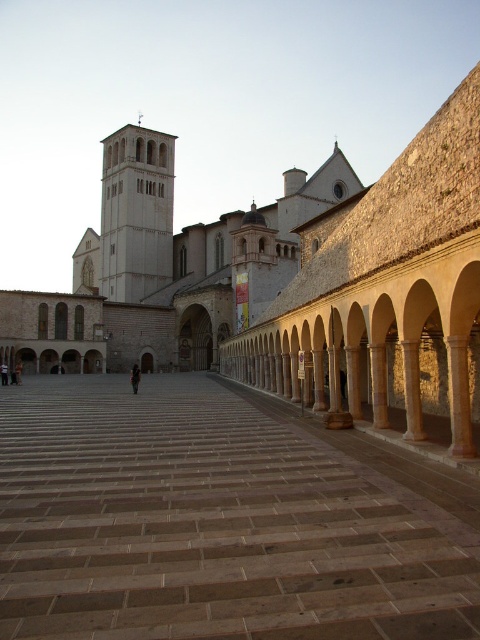
Who is more distant from viewer, (54, 428) or (113, 209)?

Point (113, 209)

Is brown stone courtyard at center shorter than white stone tower at center?

Yes, brown stone courtyard at center is shorter than white stone tower at center.

Which is behind, point (305, 416) or point (124, 257)?

Positioned behind is point (124, 257).

The height and width of the screenshot is (640, 480). What are the coordinates of `brown stone courtyard at center` in the screenshot? It's located at (220, 518).